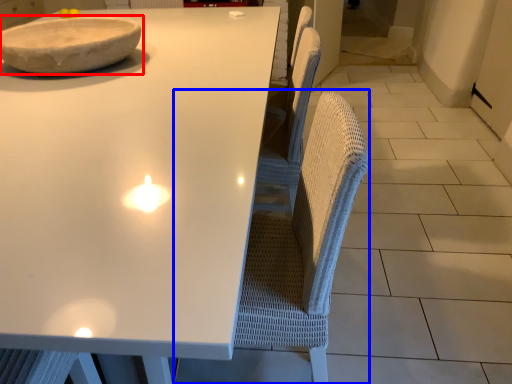
Question: Which point is further to the camera, bowl (highlighted by a red box) or swivel chair (highlighted by a blue box)?

Choices:
 (A) bowl
 (B) swivel chair

Answer: (A)